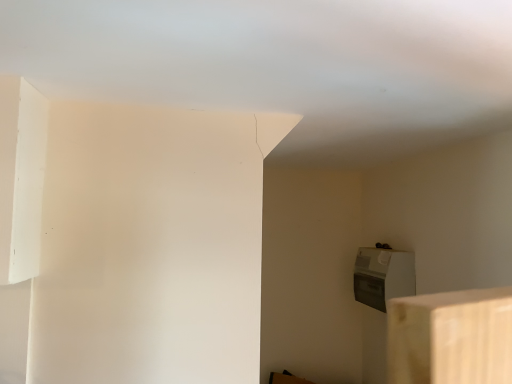
This screenshot has width=512, height=384. What do you see at coordinates (383, 276) in the screenshot?
I see `satin silver appliance at lower right` at bounding box center [383, 276].

Measure the distance between point (383, 312) and camera.

Point (383, 312) is 1.79 meters from camera.

The height and width of the screenshot is (384, 512). I want to click on satin silver appliance at lower right, so click(383, 276).

Identify the location of satin silver appliance at lower right. (383, 276).